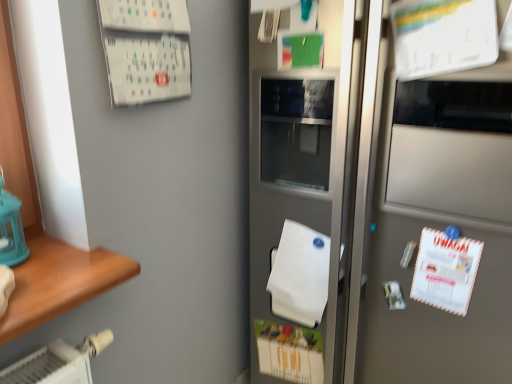
Question: Is white matte wrapping paper at center further to the viewer compared to satin silver refrigerator at center?

Choices:
 (A) no
 (B) yes

Answer: (B)

Question: Can you confirm if white matte wrapping paper at center is smaller than satin silver refrigerator at center?

Choices:
 (A) no
 (B) yes

Answer: (B)

Question: Is white matte wrapping paper at center with satin silver refrigerator at center?

Choices:
 (A) no
 (B) yes

Answer: (A)

Question: From the image's perspective, is white matte wrapping paper at center on top of satin silver refrigerator at center?

Choices:
 (A) yes
 (B) no

Answer: (B)

Question: Can you confirm if white matte wrapping paper at center is taller than satin silver refrigerator at center?

Choices:
 (A) yes
 (B) no

Answer: (B)

Question: Does white matte wrapping paper at center have a lesser width compared to satin silver refrigerator at center?

Choices:
 (A) yes
 (B) no

Answer: (A)

Question: Is satin silver refrigerator at center at the left side of white matte wrapping paper at center?

Choices:
 (A) yes
 (B) no

Answer: (B)

Question: Is satin silver refrigerator at center taller than white matte wrapping paper at center?

Choices:
 (A) no
 (B) yes

Answer: (B)

Question: Can you confirm if satin silver refrigerator at center is smaller than white matte wrapping paper at center?

Choices:
 (A) yes
 (B) no

Answer: (B)

Question: From the image's perspective, is satin silver refrigerator at center above white matte wrapping paper at center?

Choices:
 (A) yes
 (B) no

Answer: (A)

Question: Considering the relative positions of satin silver refrigerator at center and white matte wrapping paper at center in the image provided, is satin silver refrigerator at center to the right of white matte wrapping paper at center from the viewer's perspective?

Choices:
 (A) yes
 (B) no

Answer: (A)

Question: Is satin silver refrigerator at center facing towards white matte wrapping paper at center?

Choices:
 (A) no
 (B) yes

Answer: (B)

Question: Is satin silver refrigerator at center to the left or to the right of white matte wrapping paper at center in the image?

Choices:
 (A) left
 (B) right

Answer: (B)